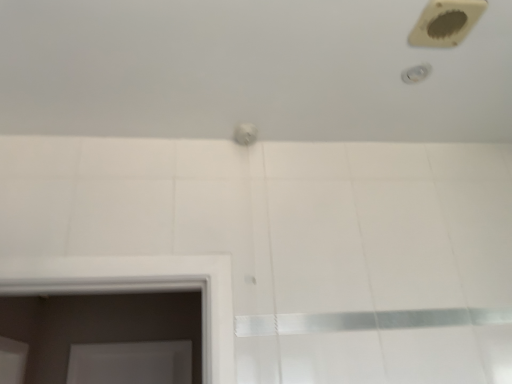
Question: From a real-world perspective, is white glossy bath at upper center on white glossy shower at upper right?

Choices:
 (A) yes
 (B) no

Answer: (A)

Question: Does white glossy bath at upper center have a larger size compared to white glossy shower at upper right?

Choices:
 (A) yes
 (B) no

Answer: (A)

Question: From the image's perspective, is white glossy bath at upper center under white glossy shower at upper right?

Choices:
 (A) no
 (B) yes

Answer: (B)

Question: Is white glossy shower at upper right inside white glossy bath at upper center?

Choices:
 (A) no
 (B) yes

Answer: (B)

Question: Could you tell me if white glossy bath at upper center is facing white glossy shower at upper right?

Choices:
 (A) yes
 (B) no

Answer: (A)

Question: From the image's perspective, is white glossy shower at upper right positioned above or below white glossy bath at upper center?

Choices:
 (A) below
 (B) above

Answer: (B)

Question: Would you say white glossy shower at upper right is inside or outside white glossy bath at upper center?

Choices:
 (A) inside
 (B) outside

Answer: (A)

Question: Considering the relative positions of white glossy shower at upper right and white glossy bath at upper center in the image provided, is white glossy shower at upper right to the left or to the right of white glossy bath at upper center?

Choices:
 (A) right
 (B) left

Answer: (A)

Question: Is white glossy shower at upper right taller or shorter than white glossy bath at upper center?

Choices:
 (A) short
 (B) tall

Answer: (A)

Question: Is white glossy bath at upper center taller or shorter than white glossy shower at upper right?

Choices:
 (A) tall
 (B) short

Answer: (A)

Question: From a real-world perspective, is white glossy bath at upper center above or below white glossy shower at upper right?

Choices:
 (A) above
 (B) below

Answer: (A)

Question: Is white glossy bath at upper center spatially inside white glossy shower at upper right, or outside of it?

Choices:
 (A) inside
 (B) outside

Answer: (B)

Question: Would you say white glossy bath at upper center is to the left or to the right of white glossy shower at upper right in the picture?

Choices:
 (A) right
 (B) left

Answer: (B)

Question: Is white glossy bath at upper center in front of or behind beige plastic hole at upper right in the image?

Choices:
 (A) behind
 (B) front

Answer: (B)

Question: Is point click(x=361, y=44) closer or farther from the camera than point click(x=438, y=26)?

Choices:
 (A) farther
 (B) closer

Answer: (A)